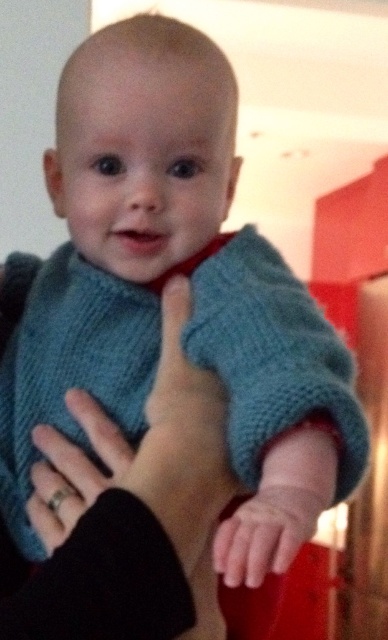
Question: Which point is closer to the camera?

Choices:
 (A) silver metallic ring at lower left
 (B) smooth skin hand at center

Answer: (B)

Question: Does silver metallic ring at lower left have a larger size compared to smooth skin hand at center?

Choices:
 (A) no
 (B) yes

Answer: (B)

Question: Which point is closer to the camera?

Choices:
 (A) smooth skin hand at center
 (B) silver metallic ring at lower left

Answer: (A)

Question: Can you confirm if silver metallic ring at lower left is wider than smooth skin hand at center?

Choices:
 (A) no
 (B) yes

Answer: (B)

Question: Does silver metallic ring at lower left have a greater width compared to smooth skin hand at center?

Choices:
 (A) no
 (B) yes

Answer: (B)